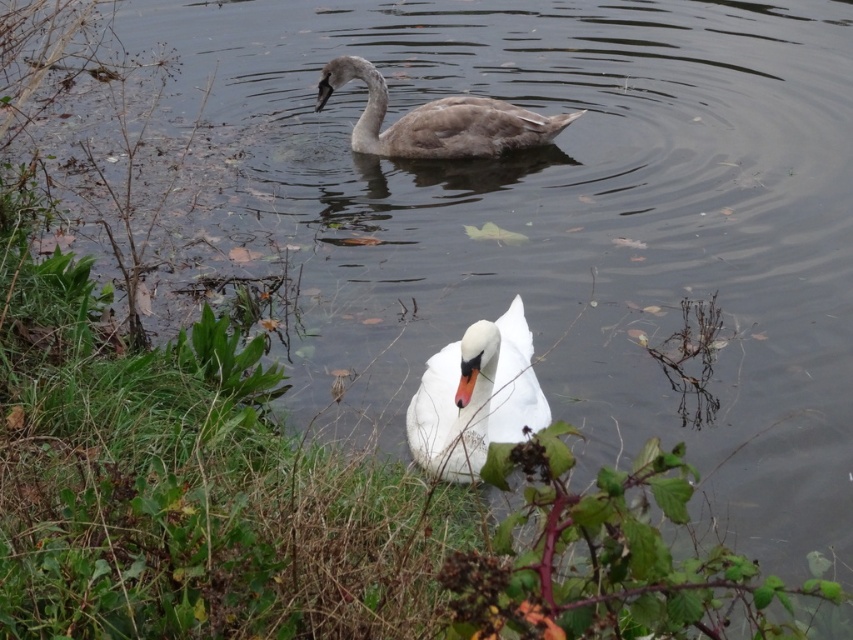
Looking at this image, can you confirm if white glossy swan at center is taller than gray matte swan at upper center?

Incorrect, white glossy swan at center's height is not larger of gray matte swan at upper center's.

This screenshot has height=640, width=853. In order to click on white glossy swan at center in this screenshot , I will do `click(474, 397)`.